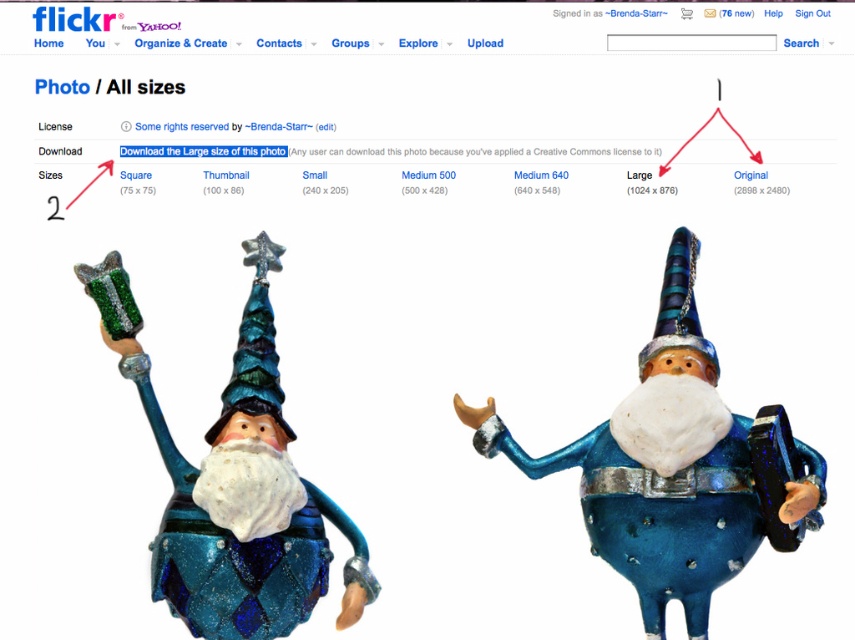
This screenshot has width=855, height=640. What do you see at coordinates (676, 467) in the screenshot? I see `matte blue glass gnome at center` at bounding box center [676, 467].

Who is taller, matte blue glass gnome at center or shiny blue glass gnome at center?

matte blue glass gnome at center

Between point (717, 534) and point (214, 620), which one is positioned in front?

Point (214, 620)

Identify the location of matte blue glass gnome at center. (676, 467).